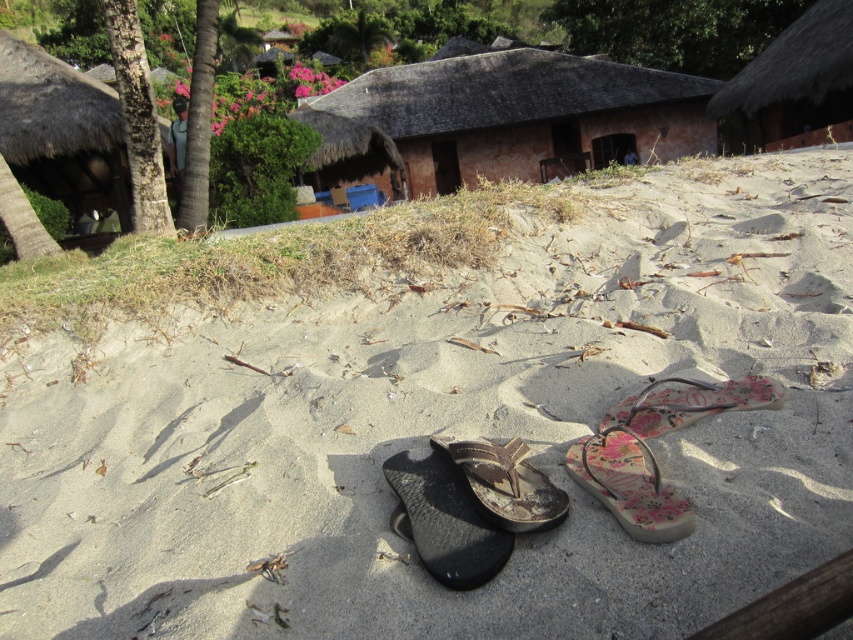
Which of these two, thatched roof hut at upper right or floral fabric flip-flop at center, stands shorter?

Standing shorter between the two is thatched roof hut at upper right.

Does point (804, 125) come behind point (656, 424)?

That is True.

Between point (822, 10) and point (747, 400), which one is positioned in front?

Point (747, 400)

Where is `thatched roof hut at upper right`? This screenshot has height=640, width=853. thatched roof hut at upper right is located at coordinates (791, 81).

Is point (612, 504) positioned before point (508, 497)?

Yes.

Which is more to the right, floral fabric flip-flop at center-right or brown leather flip-flop at center?

floral fabric flip-flop at center-right

Does point (601, 449) come farther from viewer compared to point (523, 448)?

That is False.

Locate an element on the screen. The height and width of the screenshot is (640, 853). floral fabric flip-flop at center-right is located at coordinates (630, 484).

Can you confirm if brown thatched hut at upper center is positioned to the right of brown leather flip-flop at center?

Indeed, brown thatched hut at upper center is positioned on the right side of brown leather flip-flop at center.

Is point (531, 83) positioned before point (474, 451)?

No.

Where is `brown thatched hut at upper center`? brown thatched hut at upper center is located at coordinates (524, 115).